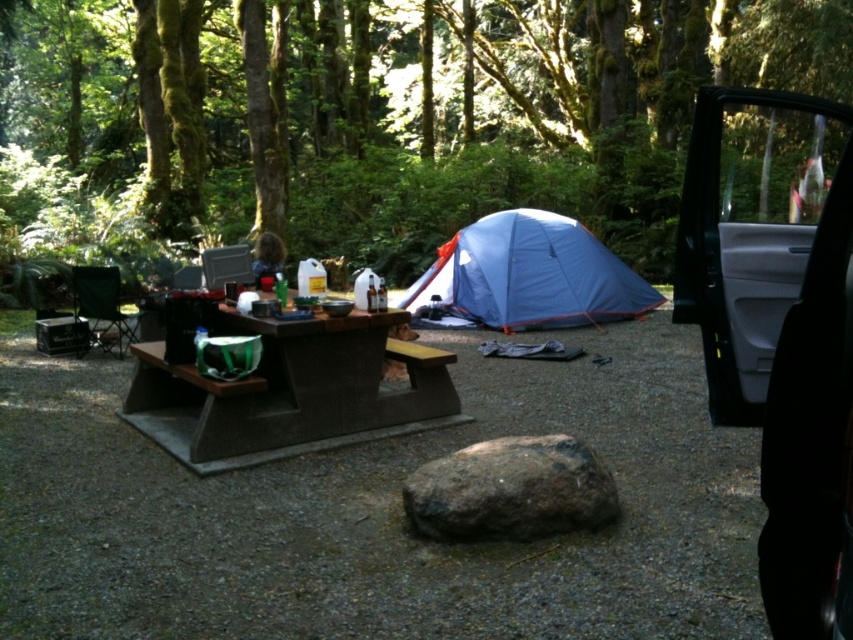
Question: Can you confirm if brown rough rock at center is wider than brown wood table at center?

Choices:
 (A) yes
 (B) no

Answer: (B)

Question: Which of the following is the closest to the observer?

Choices:
 (A) [439, 244]
 (B) [270, 413]
 (C) [564, 522]
 (D) [415, 400]

Answer: (C)

Question: Estimate the real-world distances between objects in this image. Which object is closer to the green mossy tree at upper center?

Choices:
 (A) brown rough rock at center
 (B) blue fabric tent at center

Answer: (B)

Question: Does green mossy tree at upper center appear under blue fabric tent at center?

Choices:
 (A) no
 (B) yes

Answer: (A)

Question: Is green mossy tree at upper center further to camera compared to brown wood picnic table at center?

Choices:
 (A) no
 (B) yes

Answer: (A)

Question: Which of the following is the farthest from the observer?

Choices:
 (A) brown rough rock at center
 (B) green mossy tree at upper center

Answer: (A)